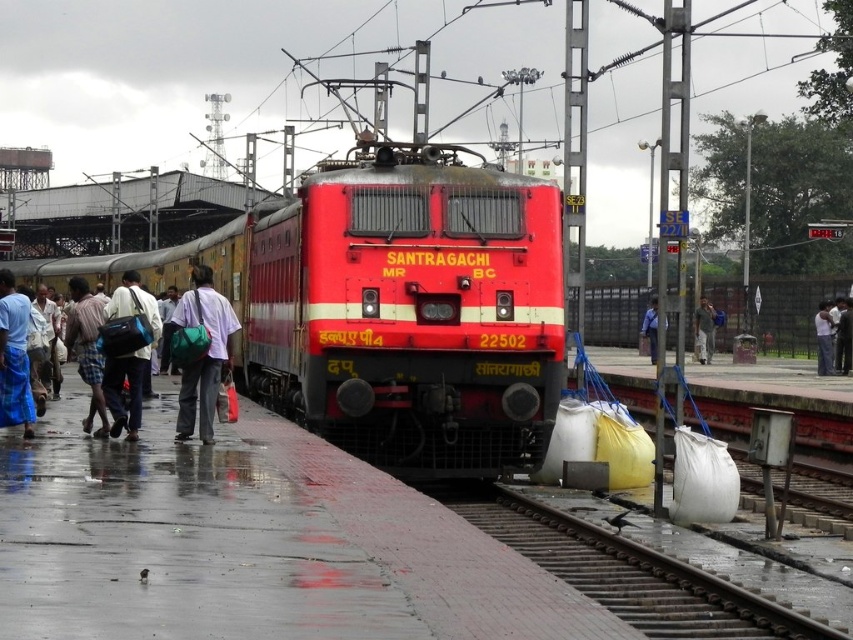
Between matte green bag at center and blue fabric bag at left, which one has more height?

blue fabric bag at left is taller.

You are a GUI agent. You are given a task and a screenshot of the screen. Output one action in this format:
    pyautogui.click(x=<x>, y=<y>)
    Task: Click on the matte green bag at center
    
    Given the screenshot: What is the action you would take?
    pyautogui.click(x=206, y=353)

Find the location of a particular element. The image size is (853, 640). matte green bag at center is located at coordinates (206, 353).

Is point (381, 326) behind point (28, 416)?

Yes, it is behind point (28, 416).

Locate an element on the screen. The image size is (853, 640). red glossy train at center is located at coordinates (392, 305).

From the picture: Is matte green bag at center in front of white fabric shirt at center?

Yes, matte green bag at center is in front of white fabric shirt at center.

Locate an element on the screen. Image resolution: width=853 pixels, height=640 pixels. matte green bag at center is located at coordinates (206, 353).

Who is more forward, [196,280] or [825,348]?

Point [196,280] is in front.

Find the location of `matte green bag at center`. matte green bag at center is located at coordinates (206, 353).